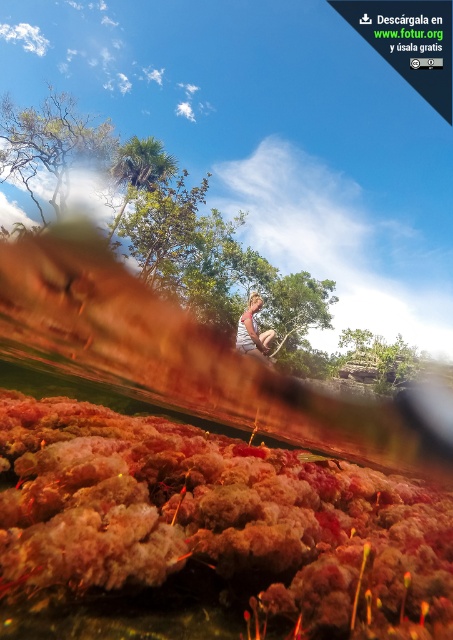
You are a photographer trying to capture a portrait of the person with their hair visible. Given the current scene, will the green leafy tree at upper center block the view of the light brown hair at center in your photo?

The green leafy tree at upper center is larger than the light brown hair at center, so it might block the view depending on the camera angle and distance. However, since the tree is at upper center and the hair is at center, adjusting the framing could allow both elements to be visible without obstruction.

Looking at the image, where is the fuzzy coral at bottom in relation to the green leafy tree at upper center?

The fuzzy coral at bottom is located to the right of the green leafy tree at upper center.

You are a photographer trying to capture a photo of the fuzzy coral at bottom and the green leafy tree at upper center in the same frame. Based on their sizes in the image, which object would appear smaller in the final photograph?

The fuzzy coral at bottom appears smaller in the final photograph because it is not as tall as the green leafy tree at upper center.